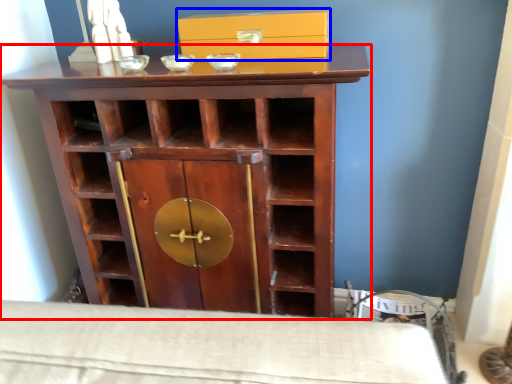
Question: Which of the following is the farthest to the observer, cupboard (highlighted by a red box) or box (highlighted by a blue box)?

Choices:
 (A) cupboard
 (B) box

Answer: (B)